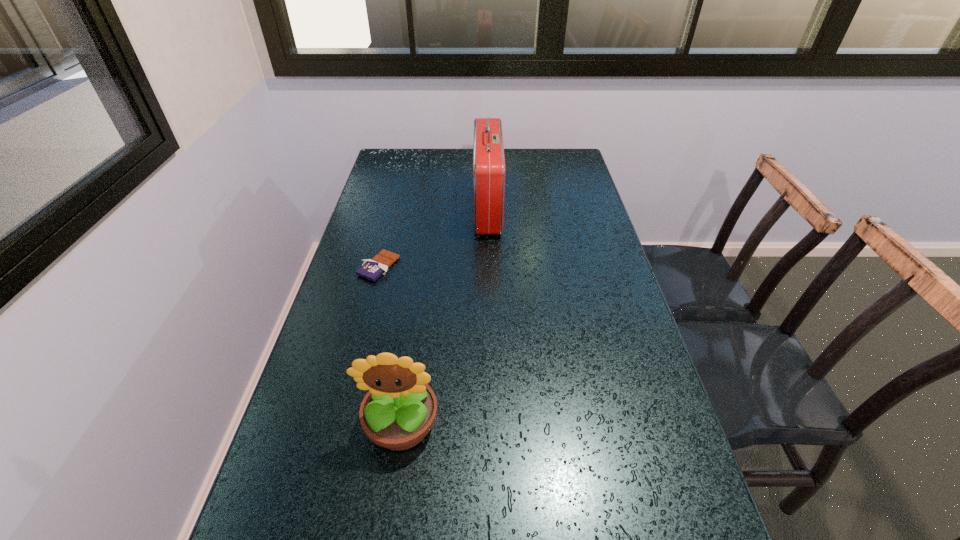
At what (x,y) coordinates should I click in order to perform the action: click on free space between the second tallest object and the chocolate bar. Please return your answer as a coordinate pair (x, y). The height and width of the screenshot is (540, 960). Looking at the image, I should click on (390, 346).

You are a GUI agent. You are given a task and a screenshot of the screen. Output one action in this format:
    pyautogui.click(x=<x>, y=<y>)
    Task: Click on the object that stands as the second closest to the nearest object
    
    Given the screenshot: What is the action you would take?
    pyautogui.click(x=488, y=151)

You are a GUI agent. You are given a task and a screenshot of the screen. Output one action in this format:
    pyautogui.click(x=<x>, y=<y>)
    Task: Click on the closest object to the shortest object
    
    Given the screenshot: What is the action you would take?
    pyautogui.click(x=488, y=151)

In order to click on free space that satisfies the following two spatial constraints: 1. on the side of the farthest object with the first aid cross symbol; 2. on the face of the second shortest object in this screenshot , I will do `click(492, 424)`.

Locate an element on the screen. vacant position in the image that satisfies the following two spatial constraints: 1. on the side of the farthest object with the first aid cross symbol; 2. on the front side of the shortest object is located at coordinates (489, 267).

Where is `vacant space that satisfies the following two spatial constraints: 1. on the side of the farthest object with the first aid cross symbol; 2. on the face of the nearest object`? The height and width of the screenshot is (540, 960). vacant space that satisfies the following two spatial constraints: 1. on the side of the farthest object with the first aid cross symbol; 2. on the face of the nearest object is located at coordinates (492, 424).